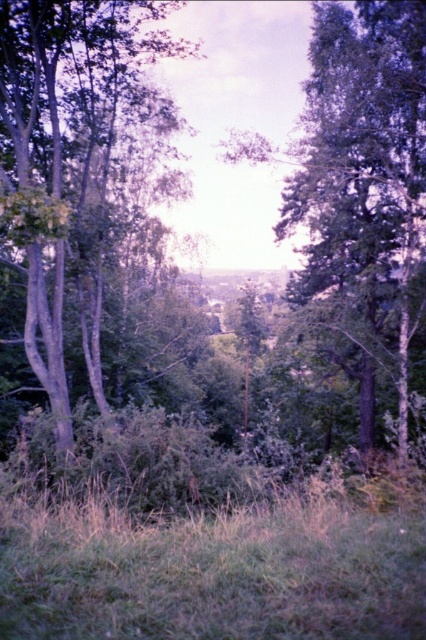
Is the position of smooth gray tree at left more distant than that of green matte tree at center?

That is True.

Between point (52, 120) and point (344, 120), which one is positioned in front?

Positioned in front is point (52, 120).

Is point (112, 250) farther from viewer compared to point (324, 109)?

No, it is not.

Find the location of a particular element. This screenshot has height=640, width=426. smooth gray tree at left is located at coordinates (85, 177).

You are a GUI agent. You are given a task and a screenshot of the screen. Output one action in this format:
    pyautogui.click(x=<x>, y=<y>)
    Task: Click on the green grass at lower center
    The height and width of the screenshot is (640, 426).
    Given the screenshot: What is the action you would take?
    pyautogui.click(x=213, y=572)

Does green grass at lower center have a lesser height compared to green matte tree at center?

Indeed, green grass at lower center has a lesser height compared to green matte tree at center.

Who is more distant from viewer, (37,586) or (420,10)?

Positioned behind is point (420,10).

Identify the location of green grass at lower center. The height and width of the screenshot is (640, 426). (213, 572).

Is smooth gray tree at left taller than green grass at lower center?

Yes.

Is point (48, 74) farther from camera compared to point (215, 577)?

Yes, point (48, 74) is behind point (215, 577).

Where is `smooth gray tree at left`? Image resolution: width=426 pixels, height=640 pixels. smooth gray tree at left is located at coordinates (85, 177).